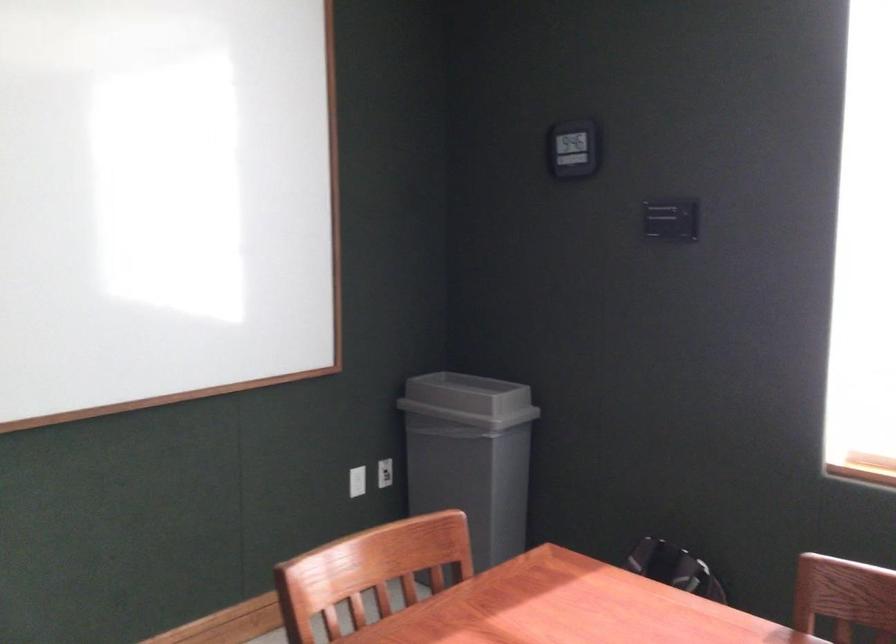
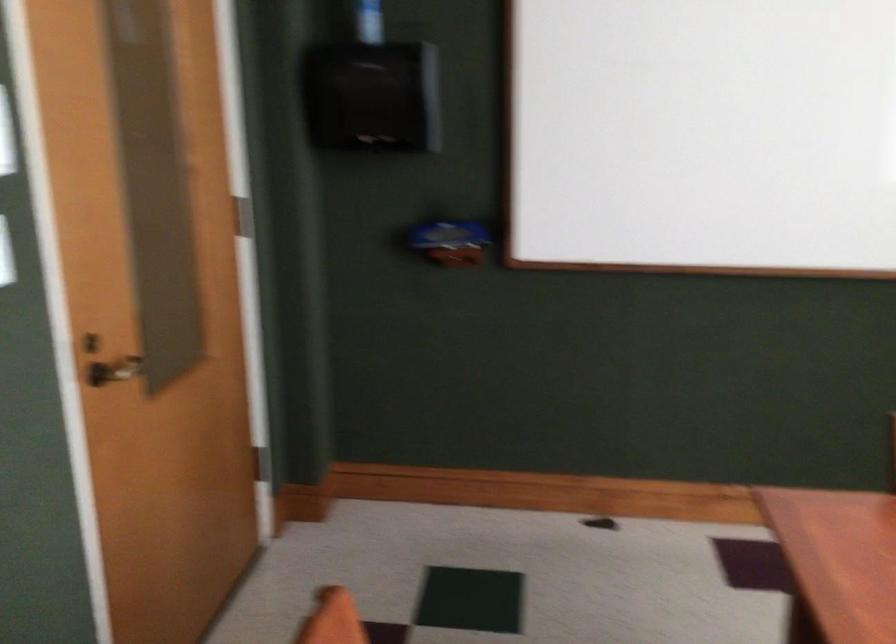
Question: The camera is either moving clockwise (left) or counter-clockwise (right) around the object. The first image is from the beginning of the video and the second image is from the end. Is the camera moving left or right when shooting the video?

Choices:
 (A) Left
 (B) Right

Answer: (B)